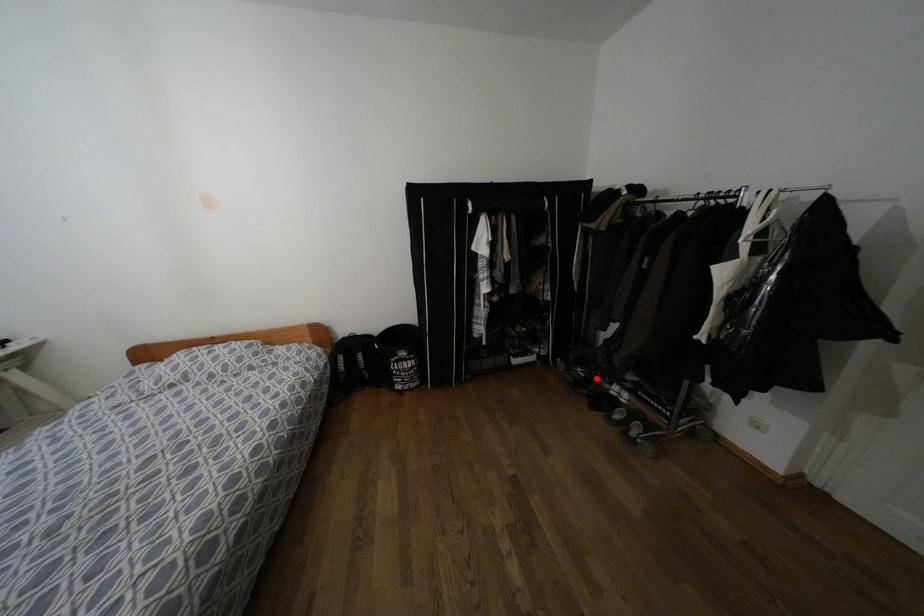
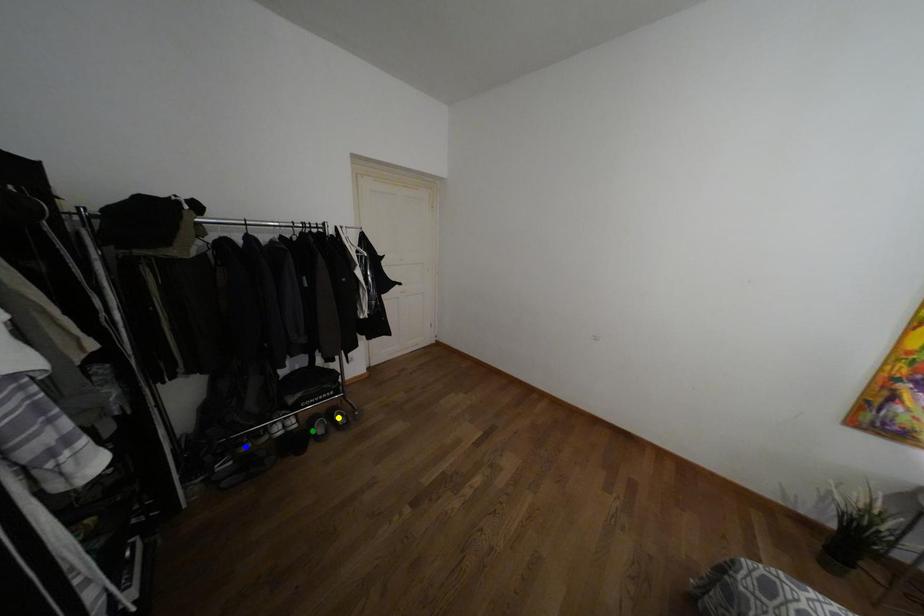
Question: I am providing you with two images of the same scene from different viewpoints. A red point is marked on the first image. You are given multiple points on the second image. Which mark in image 2 goes with the point in image 1?

Choices:
 (A) green point
 (B) yellow point
 (C) blue point

Answer: (C)